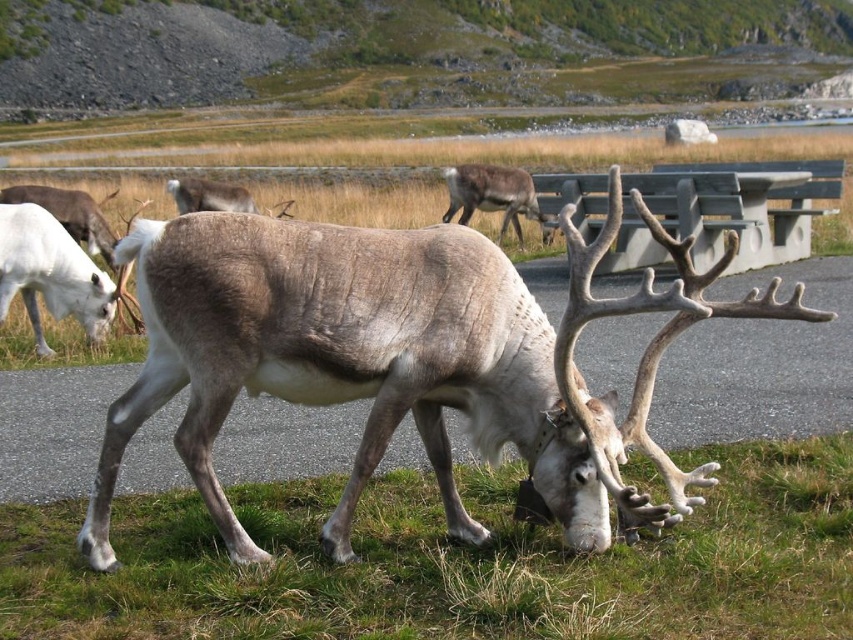
This screenshot has width=853, height=640. Describe the element at coordinates (450, 563) in the screenshot. I see `green grass at lower right` at that location.

Does green grass at lower right have a greater width compared to brown fur antlered deer at center?

Yes, green grass at lower right is wider than brown fur antlered deer at center.

Is point (317, 588) less distant than point (666, 509)?

No, (317, 588) is further to viewer.

Find the location of a particular element. green grass at lower right is located at coordinates (450, 563).

Is brown fur antlered deer at center closer to the viewer compared to brown fur reindeer at center?

Yes, brown fur antlered deer at center is in front of brown fur reindeer at center.

Does brown fur antlered deer at center appear over brown fur reindeer at center?

Actually, brown fur antlered deer at center is below brown fur reindeer at center.

Which is behind, point (544, 397) or point (447, 209)?

The point (447, 209) is more distant.

This screenshot has height=640, width=853. Find the location of `brown fur antlered deer at center`. brown fur antlered deer at center is located at coordinates (376, 358).

Is point (628, 477) positioned before point (462, 177)?

Yes, point (628, 477) is closer to viewer.

Does green grass at lower right come in front of brown fur reindeer at center?

That is True.

Is point (368, 570) positioned behind point (508, 205)?

No, (368, 570) is closer to viewer.

Locate an element on the screen. green grass at lower right is located at coordinates (450, 563).